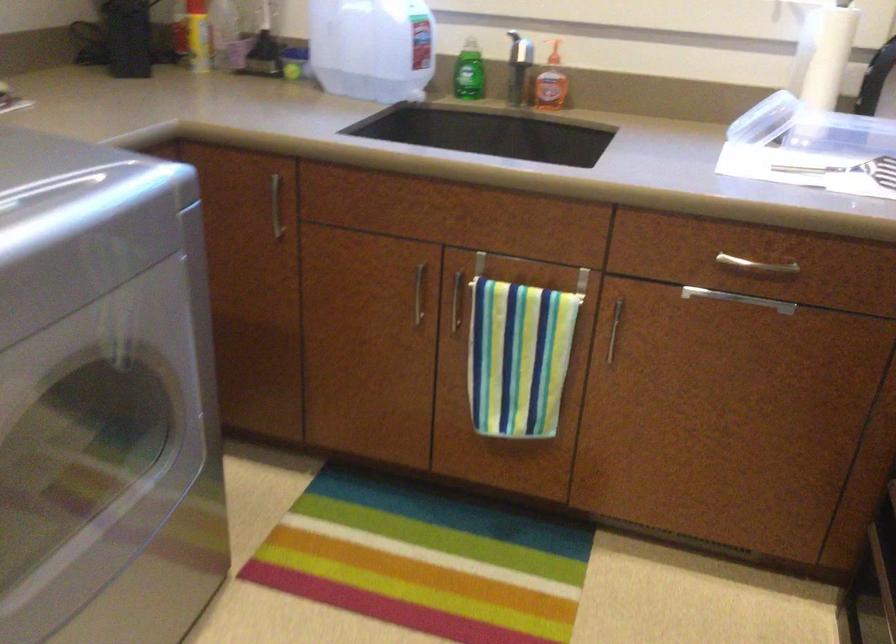
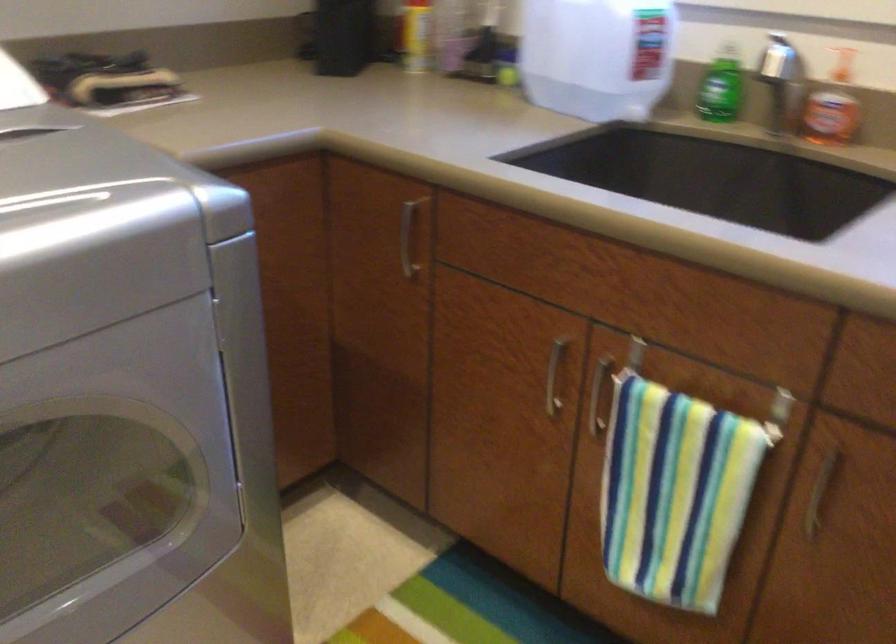
In the second image, find the point that corresponds to [412,295] in the first image.

(554, 375)